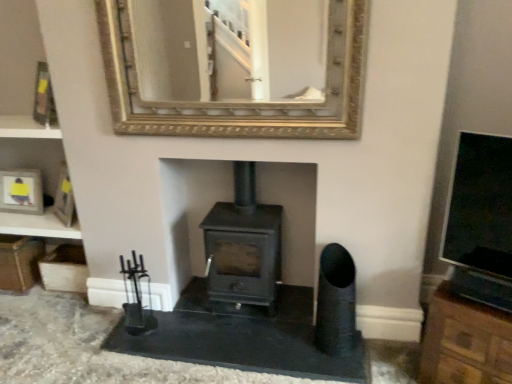
This screenshot has width=512, height=384. Find the location of `free space in front of black matte wood burning stove at center`. free space in front of black matte wood burning stove at center is located at coordinates (246, 344).